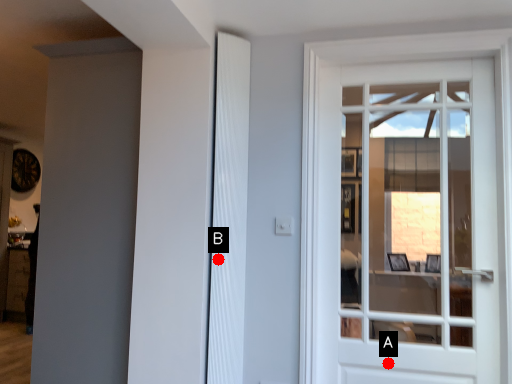
Question: Two points are circled on the image, labeled by A and B beside each circle. Which point appears farthest from the camera in this image?

Choices:
 (A) A is further
 (B) B is further

Answer: (B)